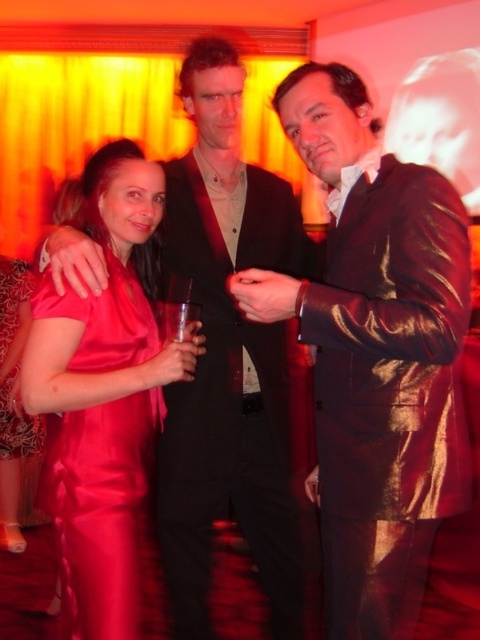
Can you confirm if matte black suit at center is shorter than black satin suit at center?

In fact, matte black suit at center may be taller than black satin suit at center.

Does point (284, 204) lie in front of point (168, 173)?

That is False.

Identify the location of matte black suit at center. (235, 368).

Between point (181, 636) and point (79, 481), which one is positioned in front?

Point (79, 481) is in front.

Locate an element on the screen. black satin suit at center is located at coordinates (235, 397).

Based on the photo, does shiny leather jacket at center have a greater height compared to satin dress at center?

Incorrect, shiny leather jacket at center's height is not larger of satin dress at center's.

Does point (361, 148) come closer to viewer compared to point (12, 332)?

Yes, it is.

This screenshot has height=640, width=480. Find the location of `shiny leather jacket at center`. shiny leather jacket at center is located at coordinates [374, 353].

The width and height of the screenshot is (480, 640). Identify the location of shiny leather jacket at center. (374, 353).